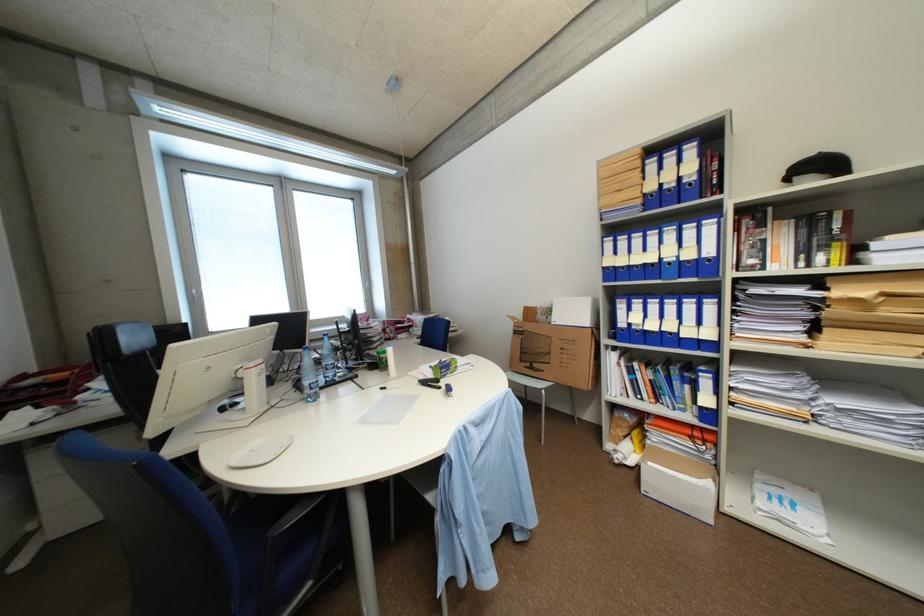
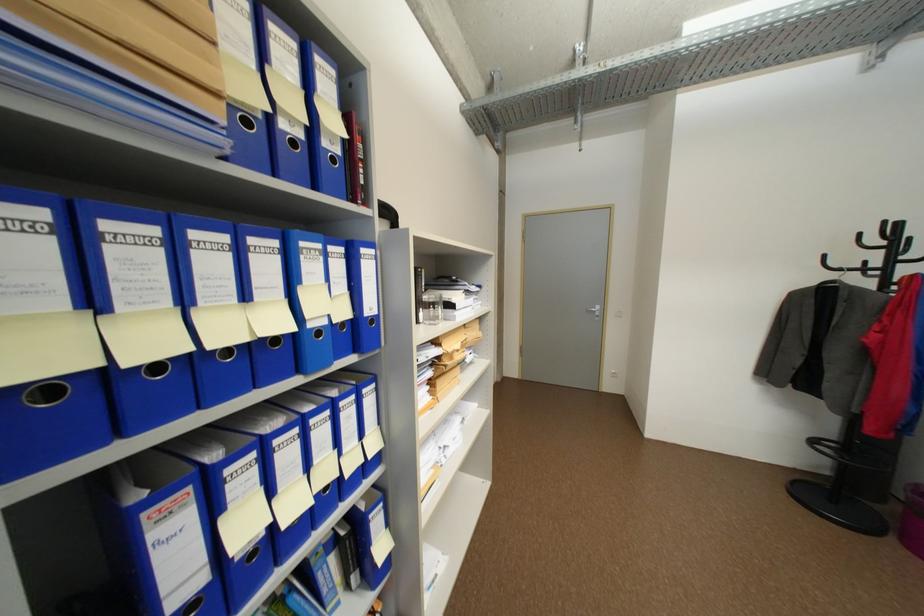
Where in the second image is the point corresponding to pixel 646 267 from the first image?

(236, 352)